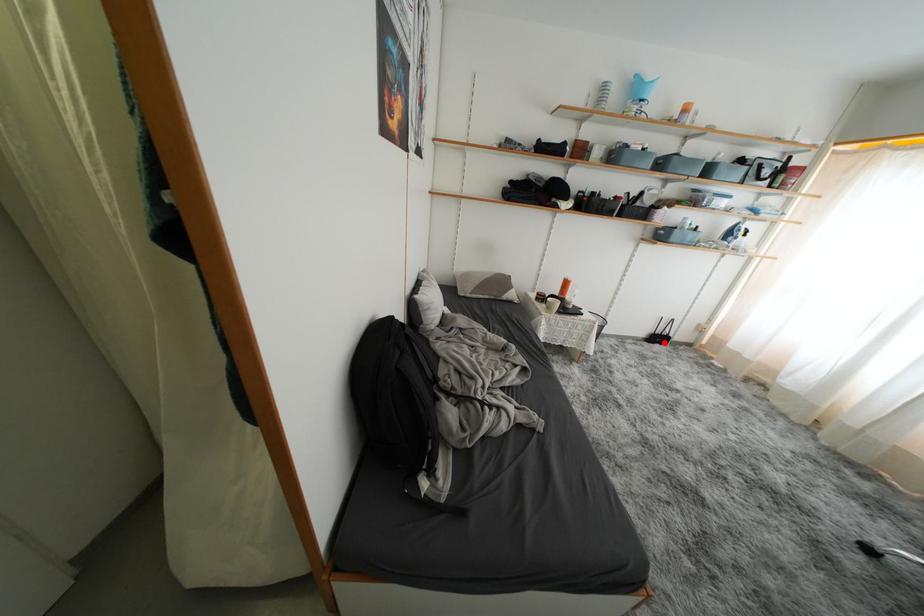
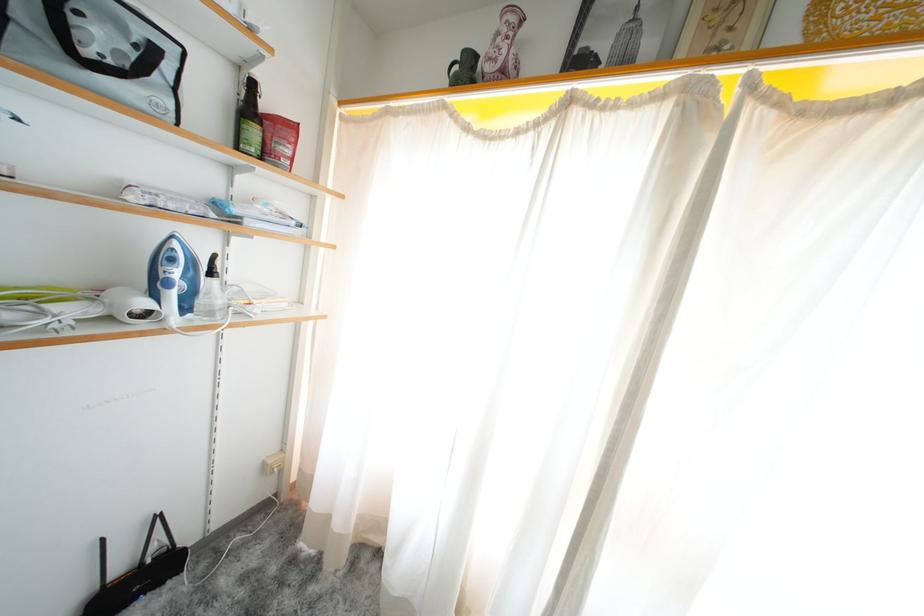
Find the pixel in the second image that matches the highlighted location in the first image.

(143, 586)